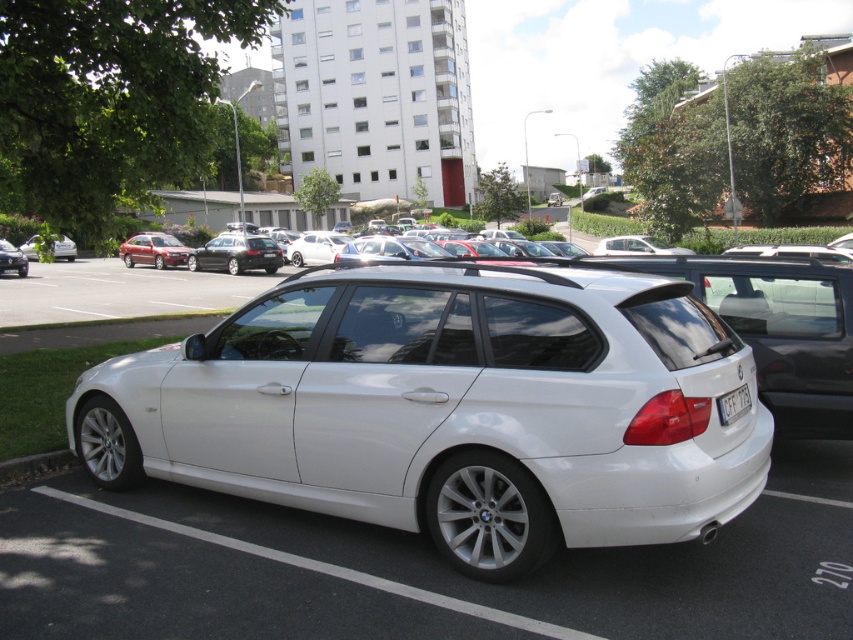
You are a parking attendant checking the alignment of vehicles in the lot. You notice the black plastic license plate at rear and the matte black sedan at left. Which object is positioned lower in the image?

The black plastic license plate at rear is positioned below the matte black sedan at left, so it is lower in the image.

You are a parking attendant who needs to note down the license plate number of the shiny black sedan at center. Where should you look on the car to find the black plastic license plate at rear?

The black plastic license plate at rear is located below the shiny black sedan at center, so you should look below the car to find it.

You are a delivery person trying to park your vehicle in the parking lot. You see the shiny black sedan at center and the black plastic license plate at rear. Which object takes up more space in the parking lot?

The shiny black sedan at center takes up more space in the parking lot because it has a larger size compared to the black plastic license plate at rear.